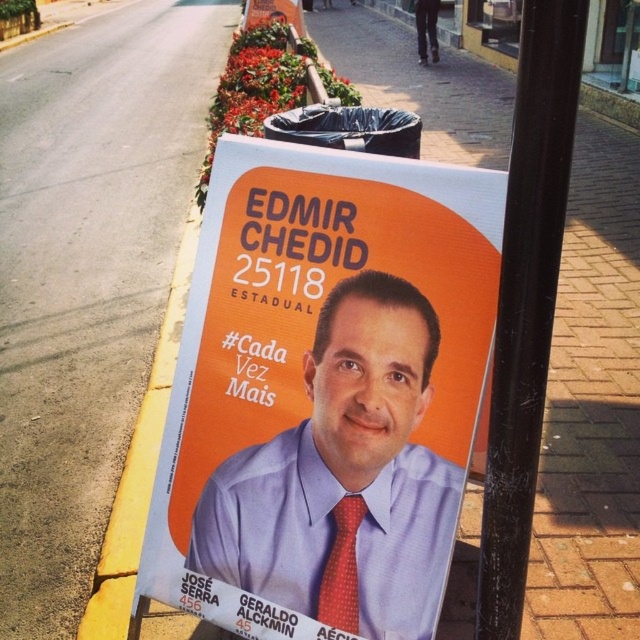
Is orange paper poster at center positioned behind orange matte poster at upper center?

No.

Is orange paper poster at center to the left of orange matte poster at upper center from the viewer's perspective?

Yes, orange paper poster at center is to the left of orange matte poster at upper center.

Between point (84, 160) and point (285, 13), which one is positioned behind?

Positioned behind is point (285, 13).

This screenshot has width=640, height=640. Find the location of `orange paper poster at center`. orange paper poster at center is located at coordinates (88, 275).

Is orange paper poster at center positioned behind black metal pole at center?

Yes, orange paper poster at center is behind black metal pole at center.

In the scene shown: Is orange paper poster at center shorter than black metal pole at center?

No.

Between point (81, 260) and point (493, 452), which one is positioned in front?

Positioned in front is point (493, 452).

Where is `orange paper poster at center`? The height and width of the screenshot is (640, 640). orange paper poster at center is located at coordinates (88, 275).

Is matte blue shirt at center to the right of orange matte poster at upper center from the viewer's perspective?

Indeed, matte blue shirt at center is positioned on the right side of orange matte poster at upper center.

Can you confirm if matte blue shirt at center is smaller than orange matte poster at upper center?

Indeed, matte blue shirt at center has a smaller size compared to orange matte poster at upper center.

Who is more distant from viewer, (348, 380) or (289, 6)?

Positioned behind is point (289, 6).

I want to click on matte blue shirt at center, so click(344, 477).